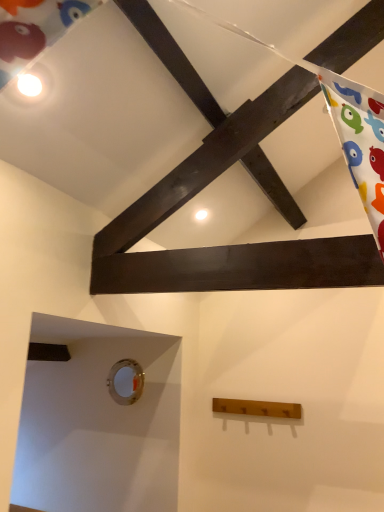
Question: Considering the relative positions of metallic circular hole at lower left and wooden coat rack at lower center in the image provided, is metallic circular hole at lower left to the left or to the right of wooden coat rack at lower center?

Choices:
 (A) left
 (B) right

Answer: (A)

Question: Based on their sizes in the image, would you say metallic circular hole at lower left is bigger or smaller than wooden coat rack at lower center?

Choices:
 (A) big
 (B) small

Answer: (B)

Question: Is metallic circular hole at lower left taller or shorter than wooden coat rack at lower center?

Choices:
 (A) tall
 (B) short

Answer: (A)

Question: In terms of height, does wooden coat rack at lower center look taller or shorter compared to metallic circular hole at lower left?

Choices:
 (A) tall
 (B) short

Answer: (B)

Question: From a real-world perspective, is wooden coat rack at lower center positioned above or below metallic circular hole at lower left?

Choices:
 (A) below
 (B) above

Answer: (A)

Question: From the image's perspective, is wooden coat rack at lower center located above or below metallic circular hole at lower left?

Choices:
 (A) above
 (B) below

Answer: (B)

Question: In the image, is wooden coat rack at lower center positioned in front of or behind metallic circular hole at lower left?

Choices:
 (A) front
 (B) behind

Answer: (A)